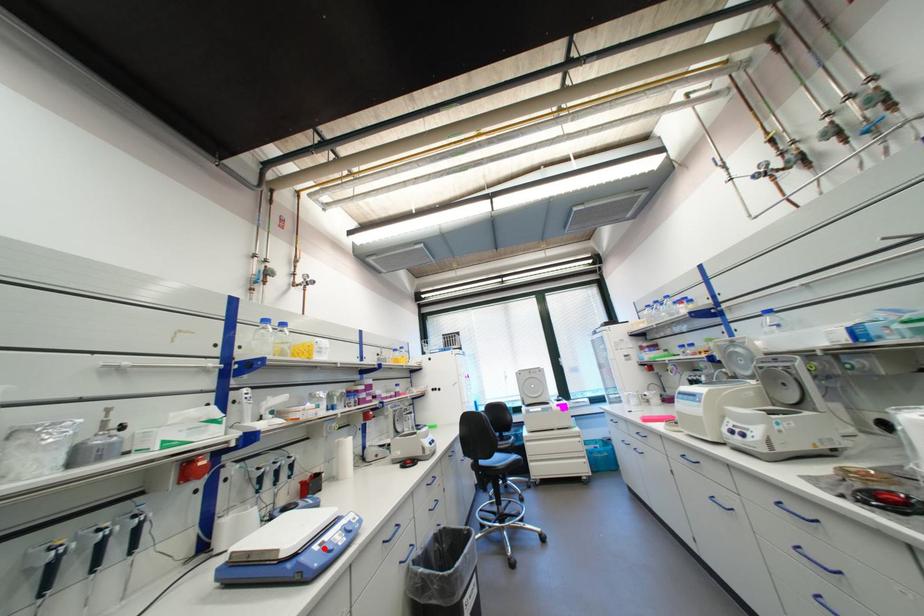
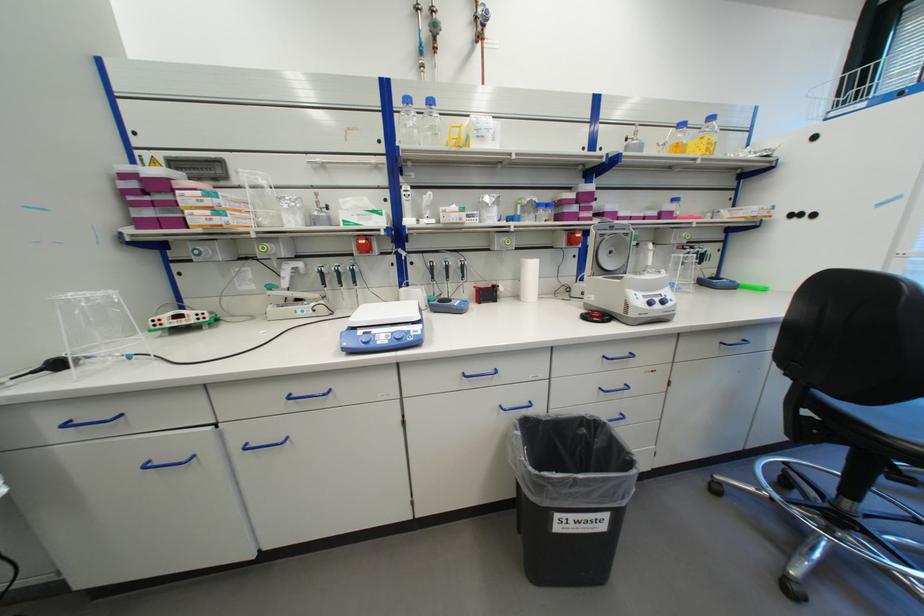
Locate, in the second image, the point that corresponds to the highlighted location in the first image.

(369, 333)